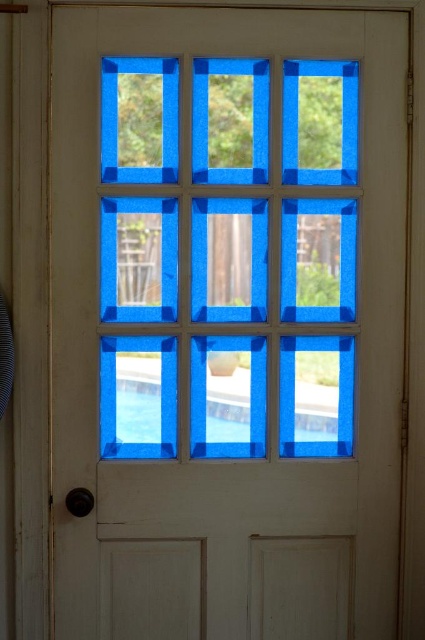
Question: Does transparent blue glass at center appear on the right side of transparent glass pool at center?

Choices:
 (A) no
 (B) yes

Answer: (A)

Question: Does transparent blue glass at center appear over transparent glass pool at center?

Choices:
 (A) yes
 (B) no

Answer: (A)

Question: Is transparent blue glass at center wider than transparent glass pool at center?

Choices:
 (A) no
 (B) yes

Answer: (B)